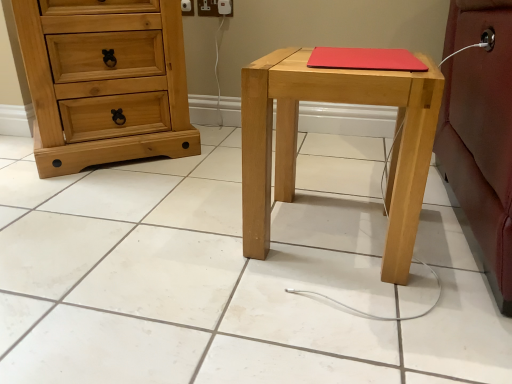
Question: Is natural wood chest of drawers at left oriented away from natural wood stool at center?

Choices:
 (A) no
 (B) yes

Answer: (A)

Question: Does natural wood chest of drawers at left have a greater width compared to natural wood stool at center?

Choices:
 (A) no
 (B) yes

Answer: (B)

Question: Does natural wood chest of drawers at left have a larger size compared to natural wood stool at center?

Choices:
 (A) no
 (B) yes

Answer: (B)

Question: Is natural wood chest of drawers at left positioned behind natural wood stool at center?

Choices:
 (A) yes
 (B) no

Answer: (A)

Question: Is natural wood chest of drawers at left outside of natural wood stool at center?

Choices:
 (A) no
 (B) yes

Answer: (B)

Question: Is natural wood chest of drawers at left positioned far away from natural wood stool at center?

Choices:
 (A) no
 (B) yes

Answer: (A)

Question: Is natural wood stool at center not close to natural wood chest of drawers at left?

Choices:
 (A) no
 (B) yes

Answer: (A)

Question: Is natural wood stool at center bigger than natural wood chest of drawers at left?

Choices:
 (A) no
 (B) yes

Answer: (A)

Question: Could you tell me if natural wood stool at center is facing natural wood chest of drawers at left?

Choices:
 (A) no
 (B) yes

Answer: (A)

Question: Can you confirm if natural wood stool at center is smaller than natural wood chest of drawers at left?

Choices:
 (A) yes
 (B) no

Answer: (A)

Question: From a real-world perspective, is natural wood stool at center on natural wood chest of drawers at left?

Choices:
 (A) no
 (B) yes

Answer: (A)

Question: Does natural wood stool at center appear on the right side of natural wood chest of drawers at left?

Choices:
 (A) yes
 (B) no

Answer: (A)

Question: Is point (84, 92) closer or farther from the camera than point (286, 150)?

Choices:
 (A) closer
 (B) farther

Answer: (B)